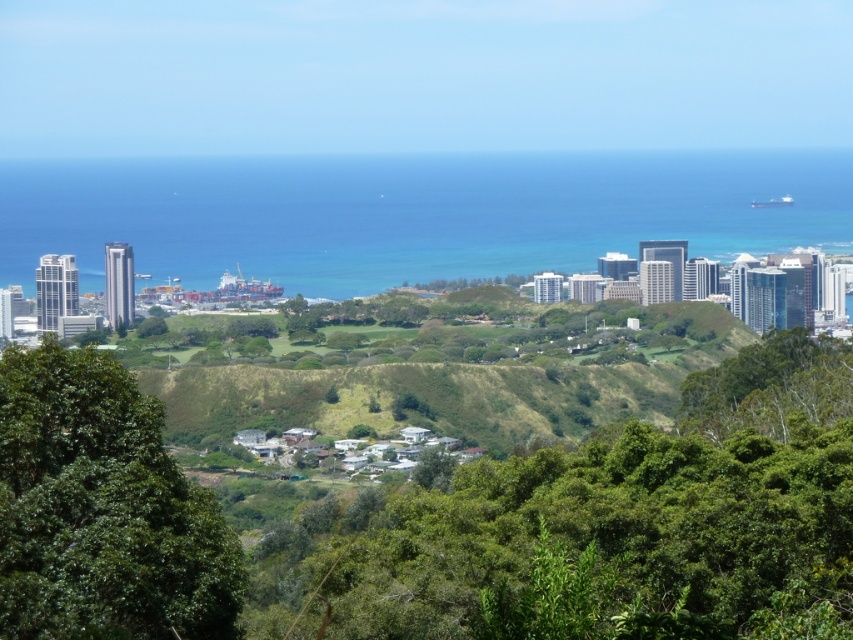
You are standing at the vantage point overlooking the coastal urban landscape. There are two points marked in the image. Which point, point (773, 509) or point (183, 529), is closer to your current position?

Point (773, 509) is further to the camera than point (183, 529). Therefore, point (183, 529) is closer to your current position.